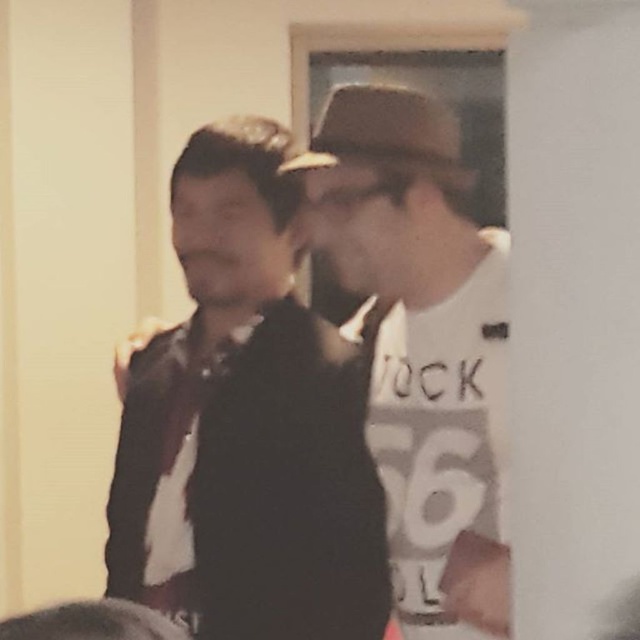
Question: Among these points, which one is farthest from the camera?

Choices:
 (A) (353, 97)
 (B) (316, 560)
 (C) (435, 560)

Answer: (B)

Question: Is white matte t-shirt at center wider than brown felt fedora at upper center?

Choices:
 (A) no
 (B) yes

Answer: (B)

Question: Which object appears closest to the camera in this image?

Choices:
 (A) white matte t-shirt at center
 (B) brown felt fedora at upper center
 (C) black velvet dress at center

Answer: (A)

Question: Does black velvet dress at center appear under brown felt fedora at upper center?

Choices:
 (A) yes
 (B) no

Answer: (A)

Question: Is white matte t-shirt at center behind brown felt fedora at upper center?

Choices:
 (A) yes
 (B) no

Answer: (B)

Question: Which object is the farthest from the brown felt fedora at upper center?

Choices:
 (A) white matte t-shirt at center
 (B) black velvet dress at center

Answer: (B)